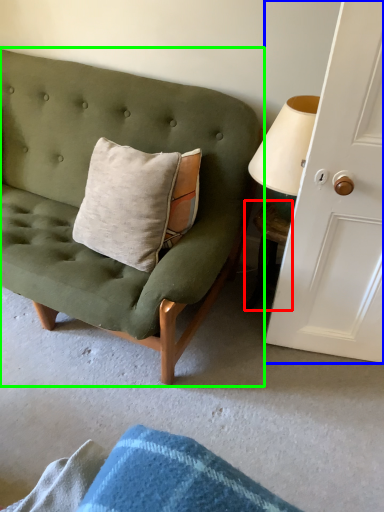
Question: Based on their relative distances, which object is nearer to table (highlighted by a red box)? Choose from door (highlighted by a blue box) and studio couch (highlighted by a green box).

Choices:
 (A) door
 (B) studio couch

Answer: (A)